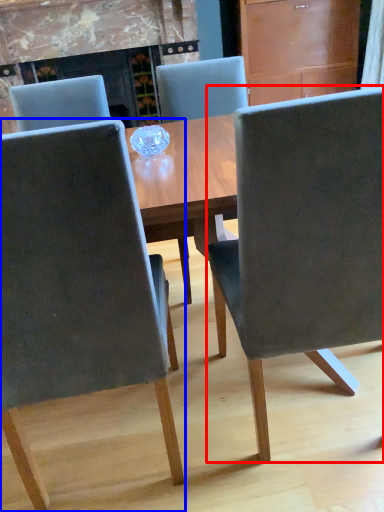
Question: Which object appears closest to the camera in this image, chair (highlighted by a red box) or chair (highlighted by a blue box)?

Choices:
 (A) chair
 (B) chair

Answer: (B)